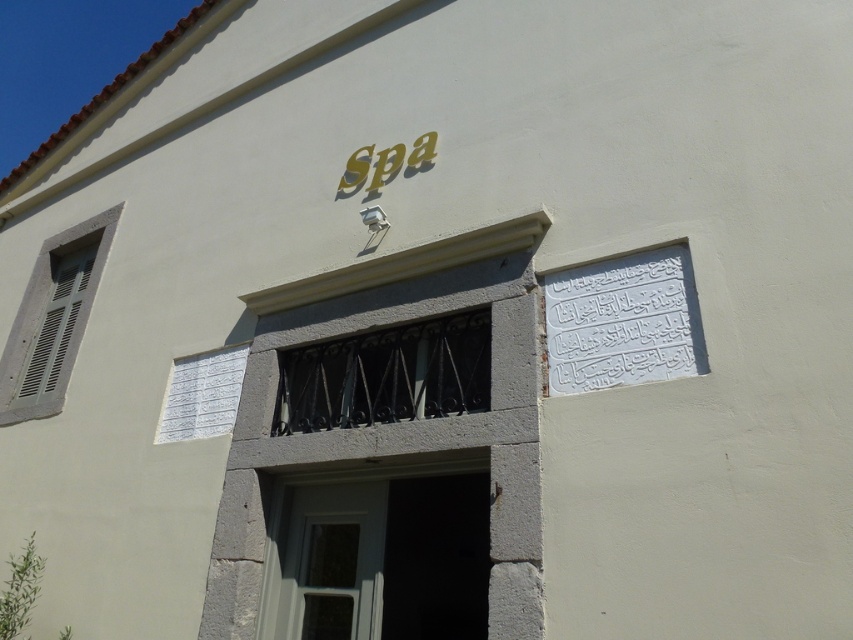
You are standing in front of the Spa building and need to enter. The entrance is marked by the white painted wood door at center. Where is the door located relative to the white carved stone plaque at upper right?

The white painted wood door at center is to the left of the white carved stone plaque at upper right.

You are a delivery person trying to deliver a package to the Spa entrance. You notice two white items on the building facade. Which one is bigger in size between the white painted wood door at center and the white carved stone plaque at upper right?

The white painted wood door at center has a larger size compared to the white carved stone plaque at upper right, so the white painted wood door at center is bigger.